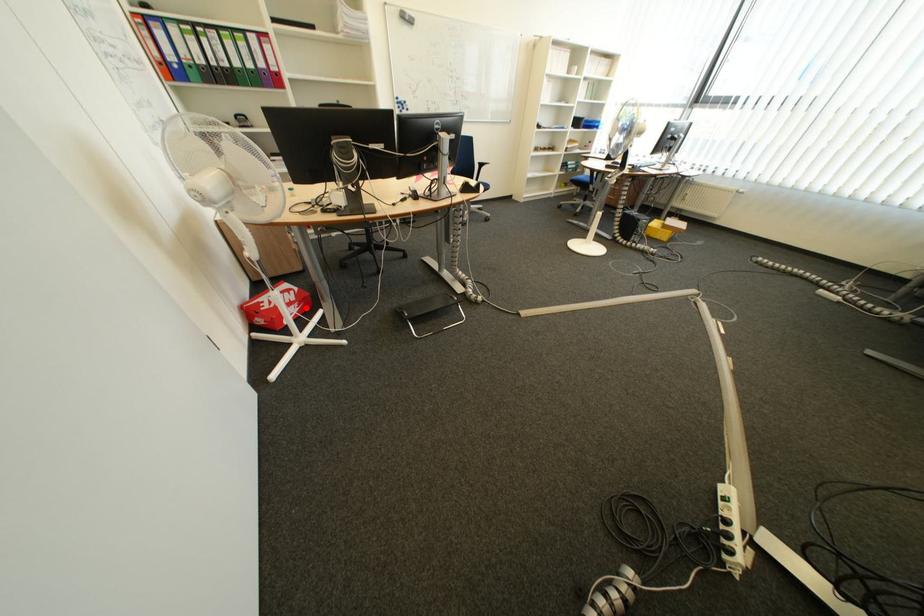
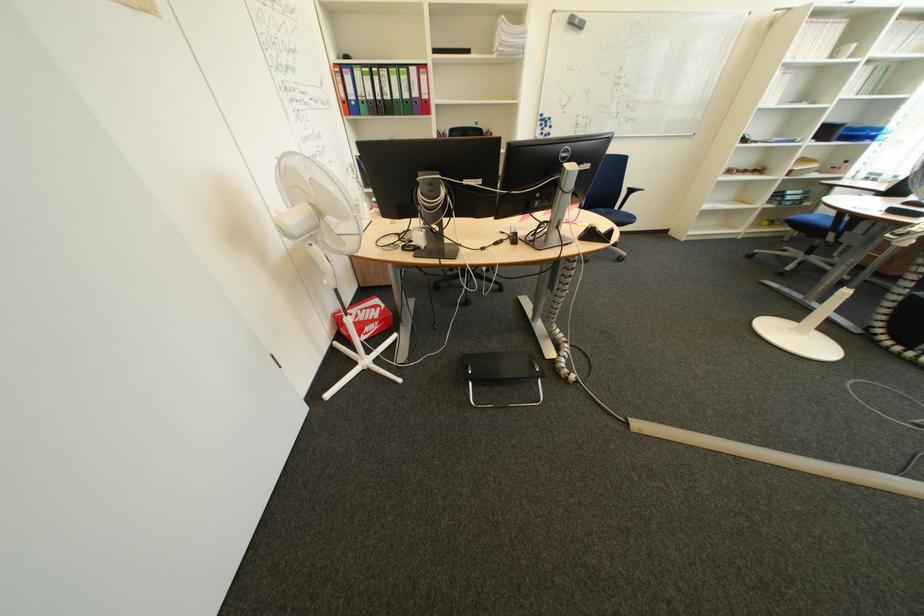
In the second image, find the point that corresponds to the highlighted location in the first image.

(385, 326)